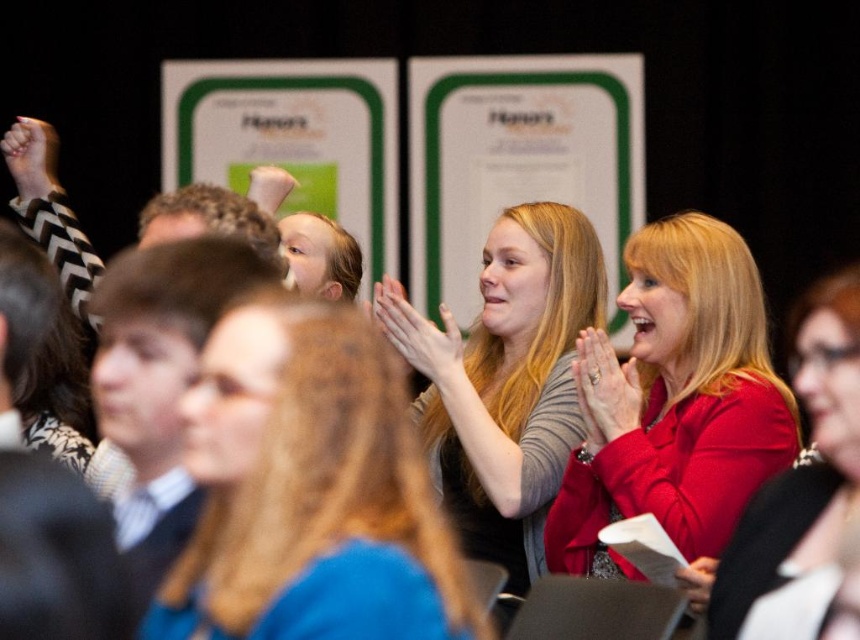
Can you confirm if matte gold ring at center is smaller than matte black paper at center?

Actually, matte gold ring at center might be larger than matte black paper at center.

Does matte gold ring at center have a larger size compared to matte black paper at center?

Indeed, matte gold ring at center has a larger size compared to matte black paper at center.

Does point (590, 396) lie in front of point (697, 561)?

No.

At what (x,y) coordinates should I click in order to perform the action: click on matte gold ring at center. Please return your answer as a coordinate pair (x, y). Looking at the image, I should click on (605, 388).

Is red satin blouse at center thinner than smooth skin face at center?

Indeed, red satin blouse at center has a lesser width compared to smooth skin face at center.

Between red satin blouse at center and smooth skin face at center, which one has more height?

Standing taller between the two is red satin blouse at center.

Where is `red satin blouse at center`? This screenshot has height=640, width=860. red satin blouse at center is located at coordinates (799, 472).

In the scene shown: Who is higher up, matte red jacket at center or red satin blouse at center?

matte red jacket at center is higher up.

This screenshot has width=860, height=640. Find the location of `matte red jacket at center`. matte red jacket at center is located at coordinates (674, 403).